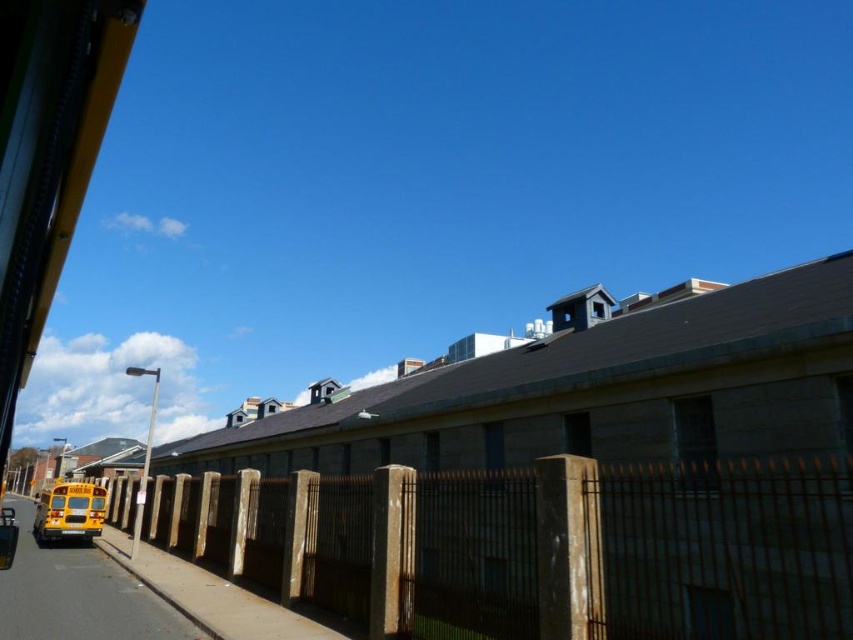
Question: Does rusty metal fence at lower left lie behind smooth asphalt road at lower left?

Choices:
 (A) no
 (B) yes

Answer: (A)

Question: Which point is farther to the camera?

Choices:
 (A) (143, 596)
 (B) (737, 572)

Answer: (A)

Question: Does rusty metal fence at lower left have a greater width compared to smooth asphalt road at lower left?

Choices:
 (A) no
 (B) yes

Answer: (A)

Question: Is rusty metal fence at lower left positioned before smooth asphalt road at lower left?

Choices:
 (A) no
 (B) yes

Answer: (B)